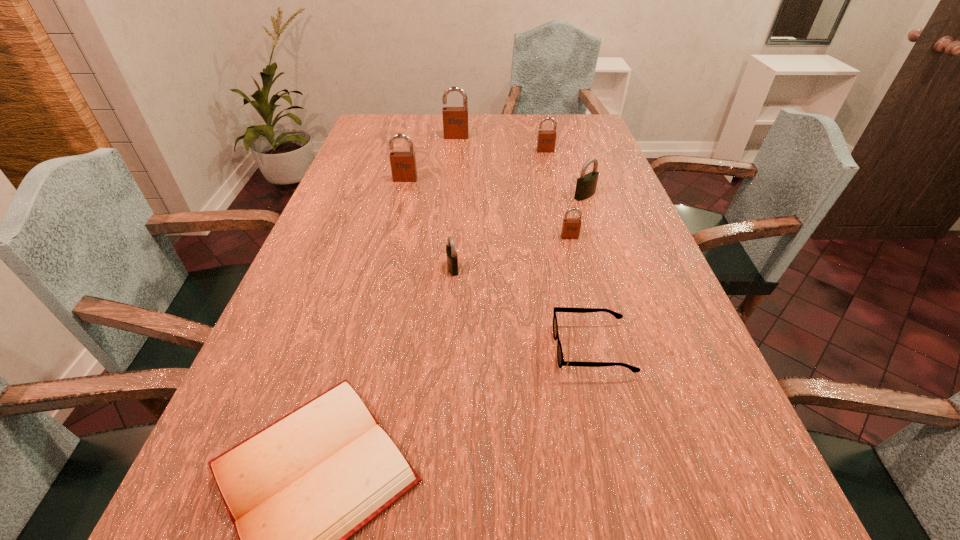
This screenshot has width=960, height=540. Find the location of `the second nearest padlock`. the second nearest padlock is located at coordinates (571, 227).

The height and width of the screenshot is (540, 960). What are the coordinates of `the nearest brown padlock` in the screenshot? It's located at (571, 227).

This screenshot has height=540, width=960. Identify the location of black spectacles. (560, 358).

The image size is (960, 540). In order to click on the seventh tallest object in this screenshot , I will do (560, 358).

At what (x,y) coordinates should I click in order to perform the action: click on vacant space located 0.290m on the front-facing side of the farthest object. Please return your answer as a coordinate pair (x, y). This screenshot has height=540, width=960. Looking at the image, I should click on (452, 180).

This screenshot has height=540, width=960. I want to click on vacant space located on the front-facing side of the second tallest padlock, so click(397, 211).

At what (x,y) coordinates should I click in order to perform the action: click on free location located 0.200m on the left of the fourth farthest object. Please return your answer as a coordinate pair (x, y). The image size is (960, 540). Looking at the image, I should click on (506, 195).

This screenshot has width=960, height=540. Find the location of `vacant point located 0.240m on the front-facing side of the second farthest brown padlock`. vacant point located 0.240m on the front-facing side of the second farthest brown padlock is located at coordinates click(x=555, y=189).

The width and height of the screenshot is (960, 540). Identify the location of vacant point located 0.340m on the right of the sixth farthest object. (600, 268).

You are a GUI agent. You are given a task and a screenshot of the screen. Output one action in this format:
    pyautogui.click(x=<x>, y=<y>)
    Task: Click on the vacant position located 0.210m on the front-facing side of the nearest brown padlock
    
    Given the screenshot: What is the action you would take?
    pyautogui.click(x=585, y=295)